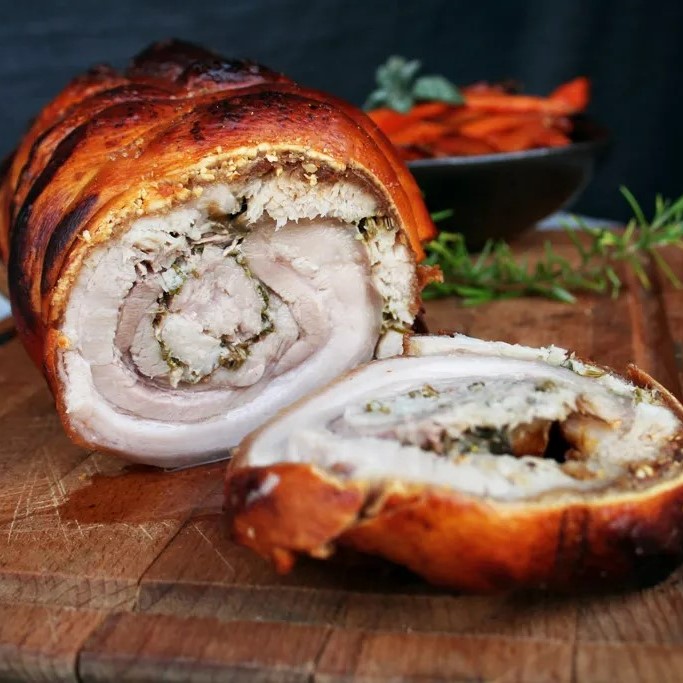
The image size is (683, 683). I want to click on rim of bowl, so click(x=507, y=156).